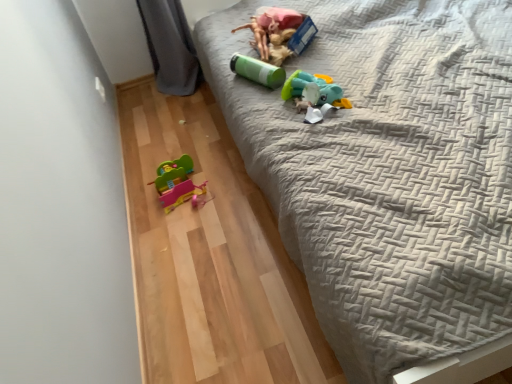
Image resolution: width=512 pixels, height=384 pixels. I want to click on vacant space situated on the left part of matte plastic toy car at lower left, marked as the 1th toy in a bottom-to-top arrangement, so click(x=144, y=199).